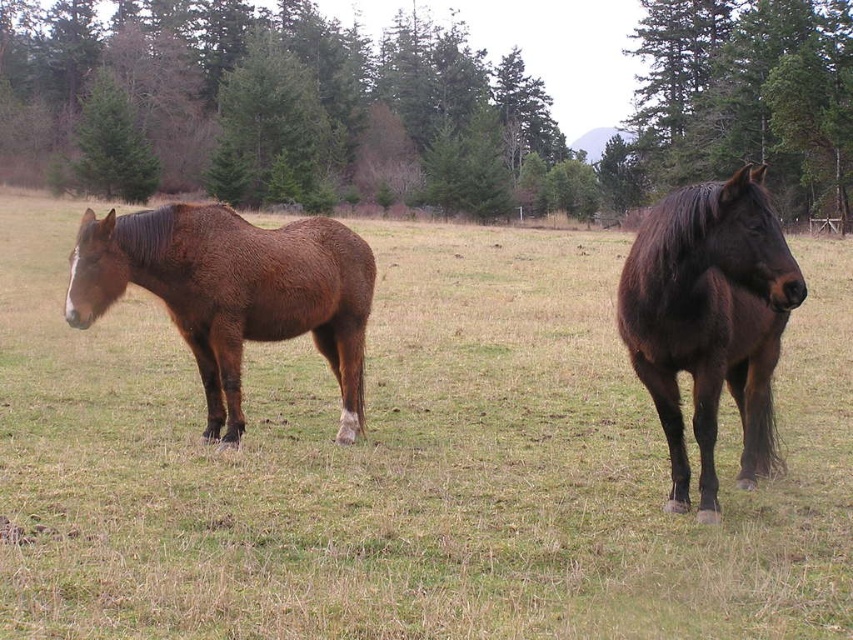
Question: Does green leafy tree at center appear over green matte tree at center?

Choices:
 (A) no
 (B) yes

Answer: (B)

Question: Is brown glossy horse at left in front of shiny dark brown horse at right?

Choices:
 (A) yes
 (B) no

Answer: (B)

Question: Which object is positioned farthest from the green matte tree at center?

Choices:
 (A) green grass at center
 (B) shiny dark brown horse at right

Answer: (A)

Question: Based on their relative distances, which object is nearer to the green matte tree at center?

Choices:
 (A) green grass at center
 (B) brown glossy horse at left

Answer: (A)

Question: Which of the following is the closest to the observer?

Choices:
 (A) (724, 252)
 (B) (302, 70)
 (C) (851, 86)

Answer: (A)

Question: Is green leafy tree at center smaller than green matte tree at upper left?

Choices:
 (A) yes
 (B) no

Answer: (B)